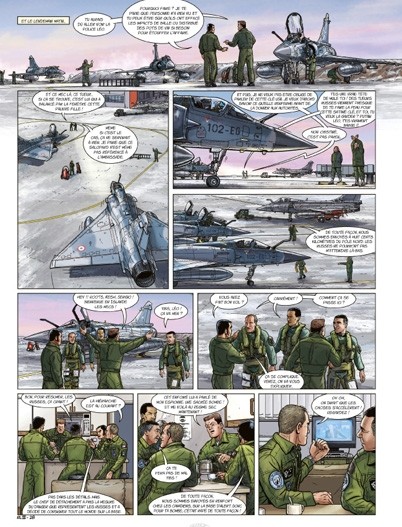
Find the location of a particular element. The height and width of the screenshot is (527, 402). stools is located at coordinates (78, 476), (123, 475).